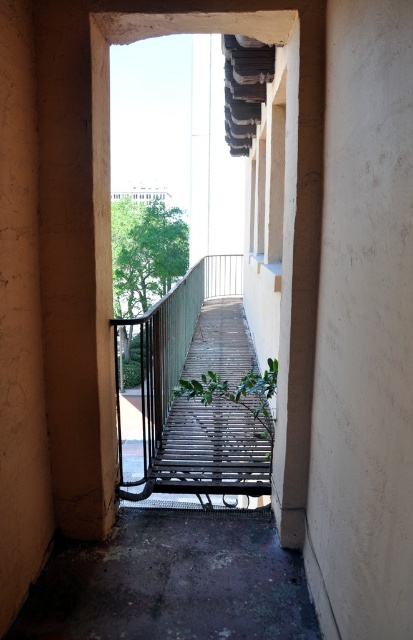
Question: Is white smooth wall at center above smooth beige wall at left?

Choices:
 (A) no
 (B) yes

Answer: (A)

Question: Which point is closer to the camera taking this photo?

Choices:
 (A) (353, 1)
 (B) (33, 524)

Answer: (A)

Question: Is white smooth wall at center below smooth beige wall at left?

Choices:
 (A) yes
 (B) no

Answer: (A)

Question: Can you confirm if white smooth wall at center is positioned to the right of smooth beige wall at left?

Choices:
 (A) yes
 (B) no

Answer: (A)

Question: Among these objects, which one is farthest from the camera?

Choices:
 (A) white smooth wall at center
 (B) smooth beige wall at left

Answer: (B)